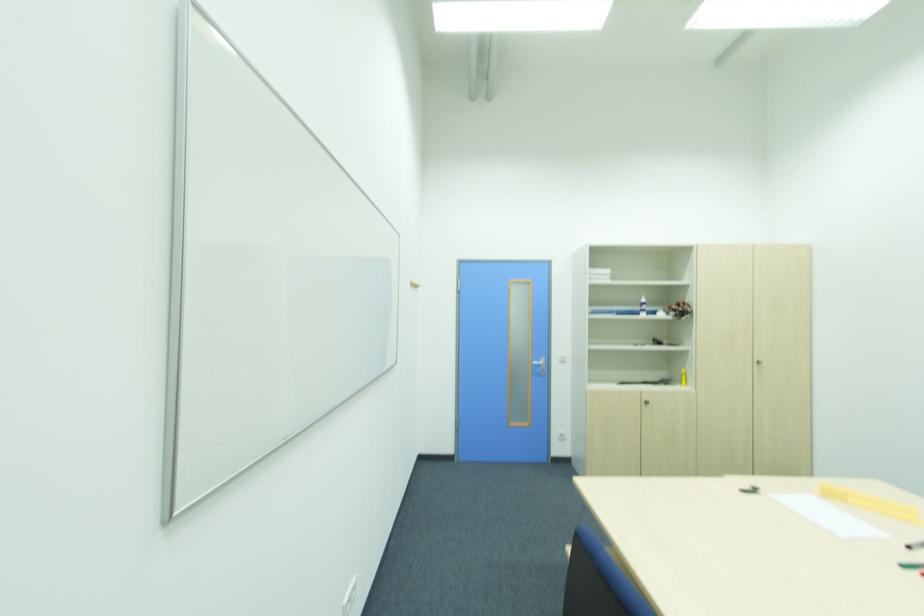
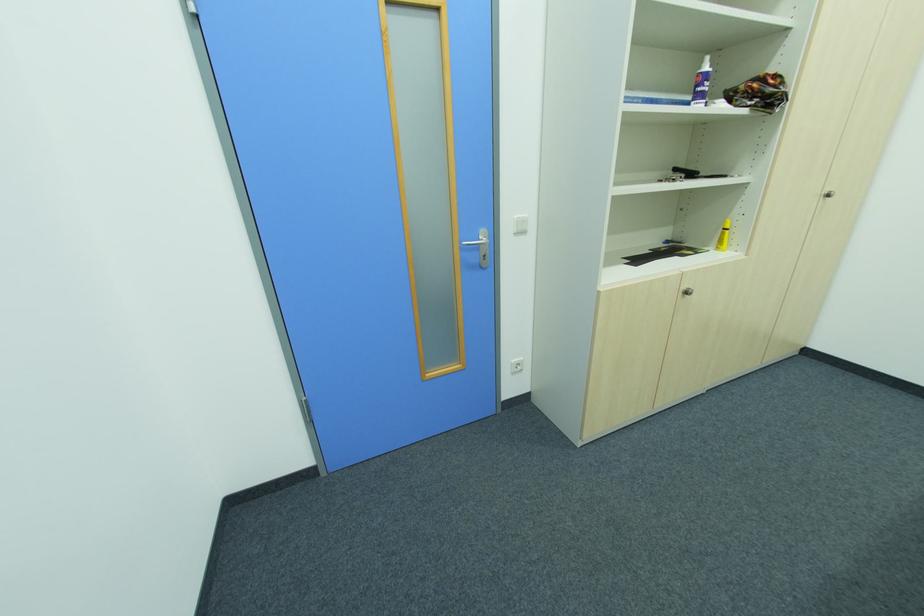
In the second image, find the point that corresponds to point 565,362 in the first image.

(525, 233)